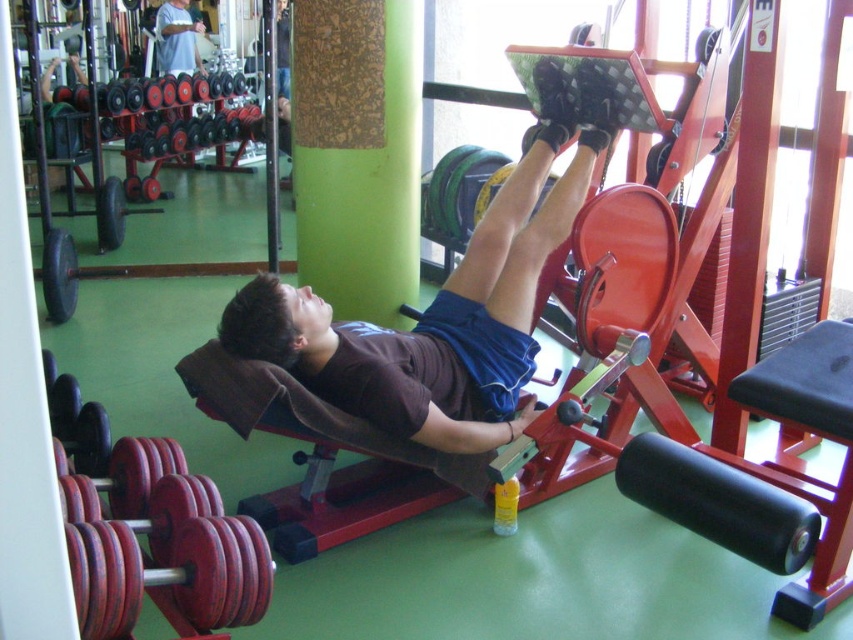
Who is more distant from viewer, (225, 314) or (355, 216)?

The point (355, 216) is more distant.

Does matte black leg press machine at center have a lesser height compared to green cork at center?

Indeed, matte black leg press machine at center has a lesser height compared to green cork at center.

Is point (583, 177) more distant than point (337, 189)?

No, (583, 177) is in front of (337, 189).

This screenshot has height=640, width=853. I want to click on matte black leg press machine at center, so click(448, 300).

Is matte black leg press machine at center positioned at the back of white cotton shirt at upper left?

That is False.

The width and height of the screenshot is (853, 640). Find the location of `matte black leg press machine at center`. matte black leg press machine at center is located at coordinates (448, 300).

Is point (379, 262) in front of point (170, 68)?

Yes, point (379, 262) is in front of point (170, 68).

Does green cork at center have a lesser height compared to white cotton shirt at upper left?

No, green cork at center is not shorter than white cotton shirt at upper left.

Identify the location of green cork at center. This screenshot has height=640, width=853. (357, 152).

At what (x,y) coordinates should I click in order to perform the action: click on green cork at center. Please return your answer as a coordinate pair (x, y). The image size is (853, 640). Looking at the image, I should click on pyautogui.click(x=357, y=152).